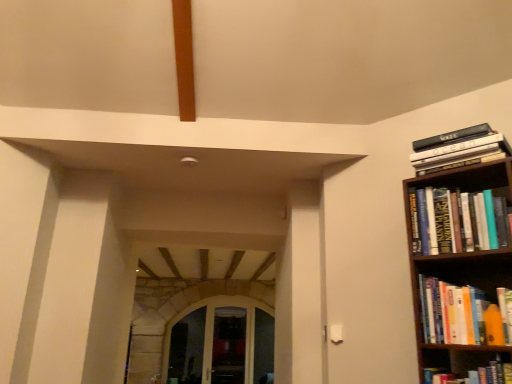
Question: Is orange matte bookshelf at right, which is the 3th book in top-to-bottom order, placed right next to hardcover book at upper right, the second book in the top-to-bottom sequence?

Choices:
 (A) yes
 (B) no

Answer: (B)

Question: Is orange matte bookshelf at right, the 2th book ordered from the bottom, thinner than hardcover book at upper right, which ranks as the 3th book in bottom-to-top order?

Choices:
 (A) no
 (B) yes

Answer: (A)

Question: Is orange matte bookshelf at right, which is the 3th book in top-to-bottom order, shorter than hardcover book at upper right, the second book in the top-to-bottom sequence?

Choices:
 (A) yes
 (B) no

Answer: (A)

Question: Can you confirm if orange matte bookshelf at right, the 2th book ordered from the bottom, is positioned to the left of hardcover book at upper right, the second book in the top-to-bottom sequence?

Choices:
 (A) no
 (B) yes

Answer: (B)

Question: Is orange matte bookshelf at right, the 2th book ordered from the bottom, positioned behind hardcover book at upper right, the second book in the top-to-bottom sequence?

Choices:
 (A) yes
 (B) no

Answer: (B)

Question: Considering the relative sizes of orange matte bookshelf at right, which is the 3th book in top-to-bottom order, and hardcover book at upper right, the second book in the top-to-bottom sequence, in the image provided, is orange matte bookshelf at right, which is the 3th book in top-to-bottom order, smaller than hardcover book at upper right, the second book in the top-to-bottom sequence,?

Choices:
 (A) yes
 (B) no

Answer: (A)

Question: Is transparent glass door at center, acting as the first glass door starting from the right, smaller than hardcover book at right, which is counted as the fourth book, starting from the top?

Choices:
 (A) no
 (B) yes

Answer: (A)

Question: Is transparent glass door at center, which ranks as the second glass door in left-to-right order, positioned with its back to hardcover book at right, arranged as the first book when ordered from the bottom?

Choices:
 (A) yes
 (B) no

Answer: (B)

Question: Does transparent glass door at center, acting as the first glass door starting from the right, have a greater width compared to hardcover book at right, which is counted as the fourth book, starting from the top?

Choices:
 (A) yes
 (B) no

Answer: (B)

Question: Considering the relative positions of transparent glass door at center, acting as the first glass door starting from the right, and hardcover book at right, which is counted as the fourth book, starting from the top, in the image provided, is transparent glass door at center, acting as the first glass door starting from the right, to the right of hardcover book at right, which is counted as the fourth book, starting from the top, from the viewer's perspective?

Choices:
 (A) yes
 (B) no

Answer: (B)

Question: From a real-world perspective, is transparent glass door at center, acting as the first glass door starting from the right, located higher than hardcover book at right, which is counted as the fourth book, starting from the top?

Choices:
 (A) yes
 (B) no

Answer: (B)

Question: Could you tell me if transparent glass door at center, which ranks as the second glass door in left-to-right order, is facing hardcover book at right, which is counted as the fourth book, starting from the top?

Choices:
 (A) no
 (B) yes

Answer: (B)

Question: Is hardcover book at right, arranged as the first book when ordered from the bottom, outside orange matte bookshelf at right, the 2th book ordered from the bottom?

Choices:
 (A) no
 (B) yes

Answer: (B)